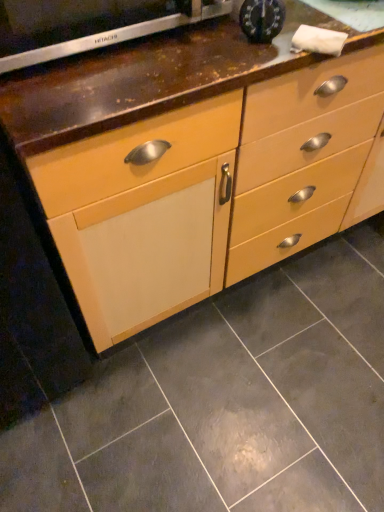
You are a GUI agent. You are given a task and a screenshot of the screen. Output one action in this format:
    pyautogui.click(x=<x>, y=<y>)
    Task: Click on the vacant point to the left of metallic clock at upper center, which ranks as the 1th appliance in right-to-left order
    
    Given the screenshot: What is the action you would take?
    pyautogui.click(x=192, y=45)